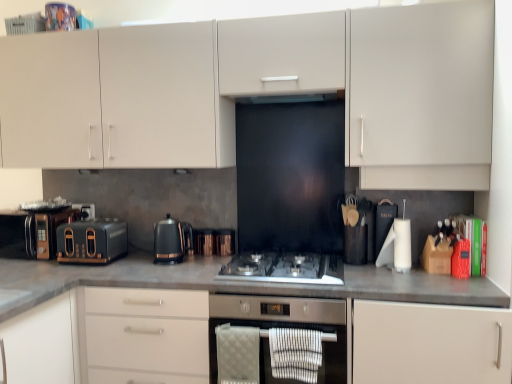
Question: Is matte white cabinet at center, which is the 2th cabinetry in top-to-bottom order, positioned before metallic copper kettle at center, the first appliance viewed from the right?

Choices:
 (A) yes
 (B) no

Answer: (A)

Question: Could you tell me if matte white cabinet at center, which is the 2th cabinetry in top-to-bottom order, is facing metallic copper kettle at center, which is the third appliance in left-to-right order?

Choices:
 (A) no
 (B) yes

Answer: (A)

Question: Is matte white cabinet at center, which is the 2th cabinetry in top-to-bottom order, shorter than metallic copper kettle at center, which is the third appliance in left-to-right order?

Choices:
 (A) yes
 (B) no

Answer: (B)

Question: Can you confirm if matte white cabinet at center, which is the 2th cabinetry in top-to-bottom order, is thinner than metallic copper kettle at center, which is the third appliance in left-to-right order?

Choices:
 (A) no
 (B) yes

Answer: (A)

Question: Is matte white cabinet at center, which is the first cabinetry from bottom to top, facing away from metallic copper kettle at center, which is the third appliance in left-to-right order?

Choices:
 (A) no
 (B) yes

Answer: (A)

Question: Looking at the image, does metallic copper kettle at center, which is the third appliance in left-to-right order, seem bigger or smaller compared to stainless steel oven at center?

Choices:
 (A) big
 (B) small

Answer: (B)

Question: In the image, is metallic copper kettle at center, the first appliance viewed from the right, positioned in front of or behind stainless steel oven at center?

Choices:
 (A) front
 (B) behind

Answer: (B)

Question: Based on their positions, is metallic copper kettle at center, the first appliance viewed from the right, located to the left or right of stainless steel oven at center?

Choices:
 (A) left
 (B) right

Answer: (A)

Question: Looking at their shapes, would you say metallic copper kettle at center, the first appliance viewed from the right, is wider or thinner than stainless steel oven at center?

Choices:
 (A) wide
 (B) thin

Answer: (B)

Question: Considering the positions of point (323, 314) and point (161, 221), is point (323, 314) closer or farther from the camera than point (161, 221)?

Choices:
 (A) closer
 (B) farther

Answer: (A)

Question: Considering their positions, is stainless steel oven at center located in front of or behind black metallic kettle at center, which appears as the 1th kitchen appliance when viewed from the right?

Choices:
 (A) front
 (B) behind

Answer: (A)

Question: Visually, is stainless steel oven at center positioned to the left or to the right of black metallic kettle at center, which ranks as the 2th kitchen appliance in left-to-right order?

Choices:
 (A) right
 (B) left

Answer: (A)

Question: In terms of height, does stainless steel oven at center look taller or shorter compared to black metallic kettle at center, which ranks as the 2th kitchen appliance in left-to-right order?

Choices:
 (A) tall
 (B) short

Answer: (A)

Question: Is point (34, 218) closer or farther from the camera than point (157, 244)?

Choices:
 (A) closer
 (B) farther

Answer: (B)

Question: Is matte black toaster at left, placed as the 1th appliance when sorted from left to right, to the left or to the right of black metallic kettle at center, which ranks as the 2th kitchen appliance in left-to-right order, in the image?

Choices:
 (A) left
 (B) right

Answer: (A)